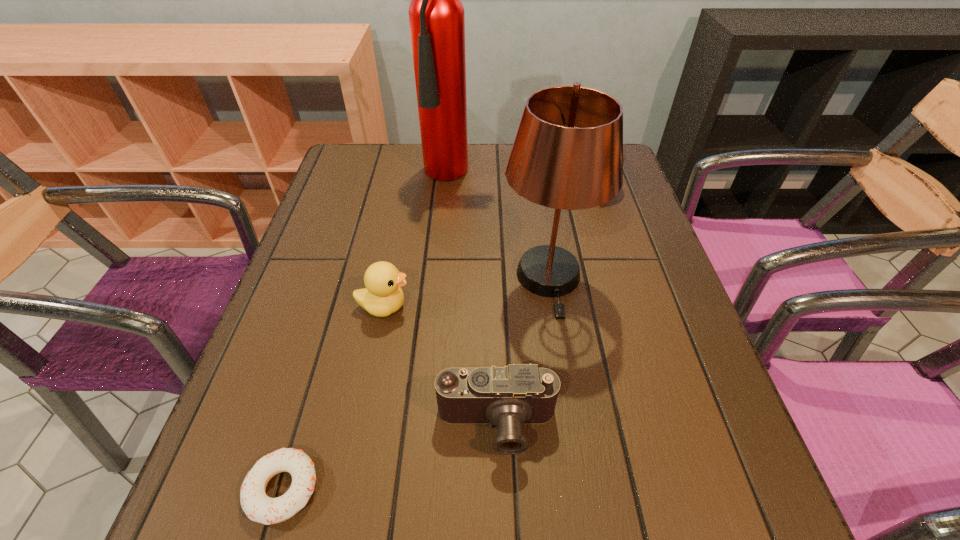
Image resolution: width=960 pixels, height=540 pixels. I want to click on free space located 0.370m on the face of the duck, so click(596, 306).

Find the location of a particular element. Image resolution: width=960 pixels, height=540 pixels. vacant space located on the front-facing side of the camera is located at coordinates (499, 511).

You are a GUI agent. You are given a task and a screenshot of the screen. Output one action in this format:
    pyautogui.click(x=<x>, y=<y>)
    Task: Click on the vacant position located 0.180m on the right of the shortest object
    This screenshot has height=540, width=960.
    Given the screenshot: What is the action you would take?
    pyautogui.click(x=443, y=489)

Identify the location of fire extinguisher that is at the far edge. (436, 14).

Locate an element on the screen. The width and height of the screenshot is (960, 540). bowl located in the far edge section of the desktop is located at coordinates (623, 150).

Locate an element on the screen. The width and height of the screenshot is (960, 540). object located in the near edge section of the desktop is located at coordinates (258, 507).

Image resolution: width=960 pixels, height=540 pixels. Identify the location of duck that is at the left edge. (383, 295).

This screenshot has width=960, height=540. I want to click on doughnut that is positioned at the left edge, so click(258, 507).

Identify the location of lampshade at the right edge. (567, 154).

Find the location of a particular element. This screenshot has width=960, height=540. bowl present at the right edge is located at coordinates (623, 150).